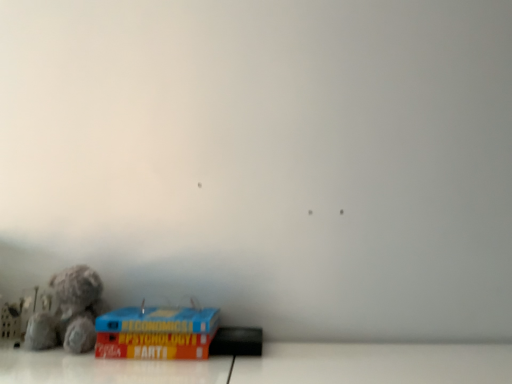
Question: Is fuzzy fabric teddy bear at lower left wider or thinner than blue cardboard box at lower left?

Choices:
 (A) wide
 (B) thin

Answer: (B)

Question: Visually, is fuzzy fabric teddy bear at lower left positioned to the left or to the right of blue cardboard box at lower left?

Choices:
 (A) right
 (B) left

Answer: (B)

Question: From the image's perspective, is fuzzy fabric teddy bear at lower left above or below blue cardboard box at lower left?

Choices:
 (A) above
 (B) below

Answer: (A)

Question: Visually, is blue cardboard box at lower left positioned to the left or to the right of fuzzy fabric teddy bear at lower left?

Choices:
 (A) left
 (B) right

Answer: (B)

Question: From the image's perspective, is blue cardboard box at lower left above or below fuzzy fabric teddy bear at lower left?

Choices:
 (A) above
 (B) below

Answer: (B)

Question: Is blue cardboard box at lower left wider or thinner than fuzzy fabric teddy bear at lower left?

Choices:
 (A) wide
 (B) thin

Answer: (A)

Question: In the image, is blue cardboard box at lower left positioned in front of or behind fuzzy fabric teddy bear at lower left?

Choices:
 (A) front
 (B) behind

Answer: (A)